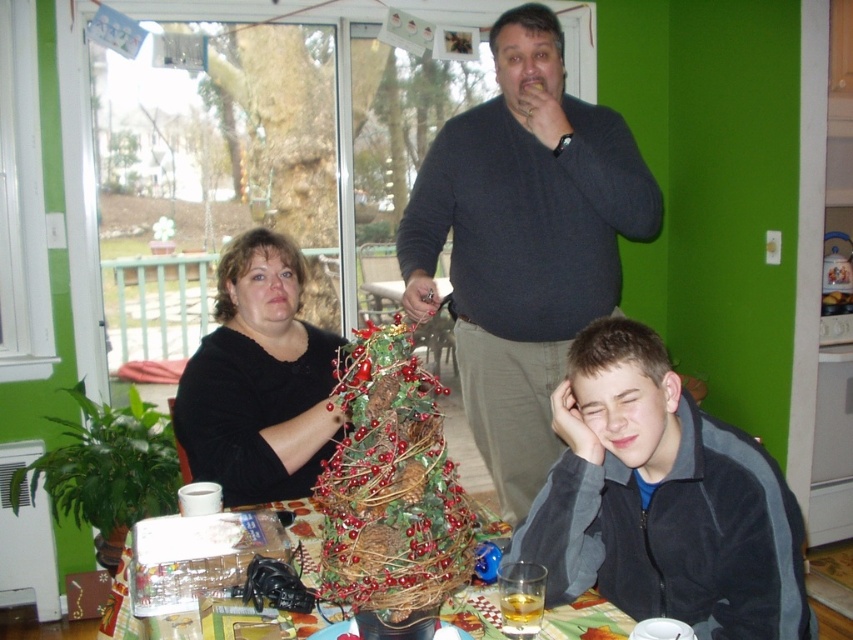
Question: Is bright red berries at center above black matte shirt at center?

Choices:
 (A) yes
 (B) no

Answer: (B)

Question: Can you confirm if gray fleece jacket at lower right is smaller than black matte shirt at center?

Choices:
 (A) yes
 (B) no

Answer: (A)

Question: Which of these objects is positioned farthest from the black matte shirt at center?

Choices:
 (A) wooden table at center
 (B) gray fleece jacket at lower right
 (C) bright red berries at center
 (D) dark gray sweater at upper center

Answer: (B)

Question: Which object is positioned farthest from the bright red berries at center?

Choices:
 (A) dark gray sweater at upper center
 (B) gray fleece jacket at lower right
 (C) black matte shirt at center

Answer: (A)

Question: Can you confirm if gray fleece jacket at lower right is positioned to the left of wooden table at center?

Choices:
 (A) yes
 (B) no

Answer: (B)

Question: Which point is farther to the camera?

Choices:
 (A) bright red berries at center
 (B) gray fleece jacket at lower right

Answer: (B)